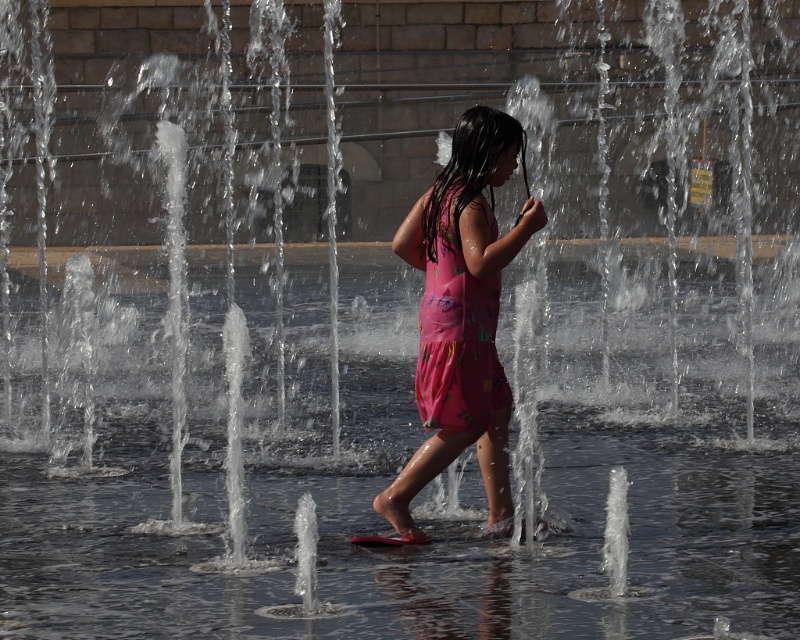
You are standing at the edge of the fountain and want to reach both the point at coordinates point (384, 515) and the point at coordinates point (448, 380). Which point should you reach first if you want to minimize the distance walked?

You should reach the point at coordinates point (384, 515) first because it is closer to you than the point at coordinates point (448, 380), as it is further away.

You are a photographer trying to capture the best shot of the girl in the pink floral dress at center and the pink floral fabric dress at center. Since you want to emphasize the size difference between them, which one should you zoom in on more?

To emphasize the size difference between the pink floral dress at center and the pink floral fabric dress at center, you should zoom in more on the pink floral dress at center since it has a larger size compared to the pink floral fabric dress at center.

You are a photographer trying to capture the girl in her outfit. You notice two descriptions of her dress in your notes. One says it is a pink floral dress at center, and the other mentions a pink floral fabric dress at center. Which description refers to the wider garment?

The pink floral dress at center is wider than the pink floral fabric dress at center, so the description referring to the pink floral dress at center is the wider garment.